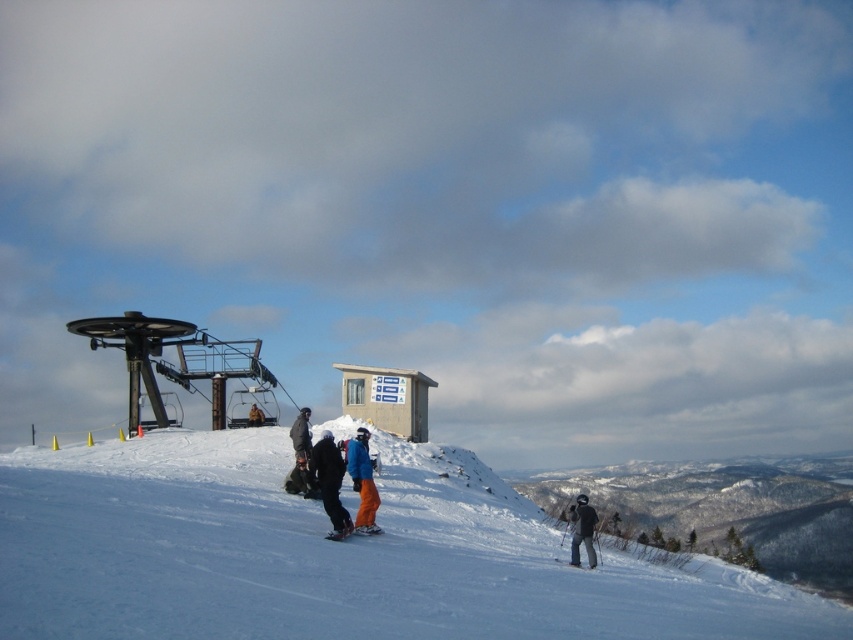
You are a winter sports instructor planning to set up a beginner course between the blue snowboarder at center and the orange matte ski at center. The minimum required distance for the course is 30 feet. Can the space between them accommodate the course?

The distance between the blue snowboarder at center and the orange matte ski at center is 34.19 feet, which exceeds the minimum requirement of 30 feet. Therefore, the space can accommodate the beginner course.

You are a winter sports enthusiast who wants to know if the orange matte ski at lower center is fully submerged in the white powdery snow at center. Based on the scene, can you determine this?

The white powdery snow at center has a greater height compared to the orange matte ski at lower center, so the orange matte ski at lower center is fully submerged in the white powdery snow at center.